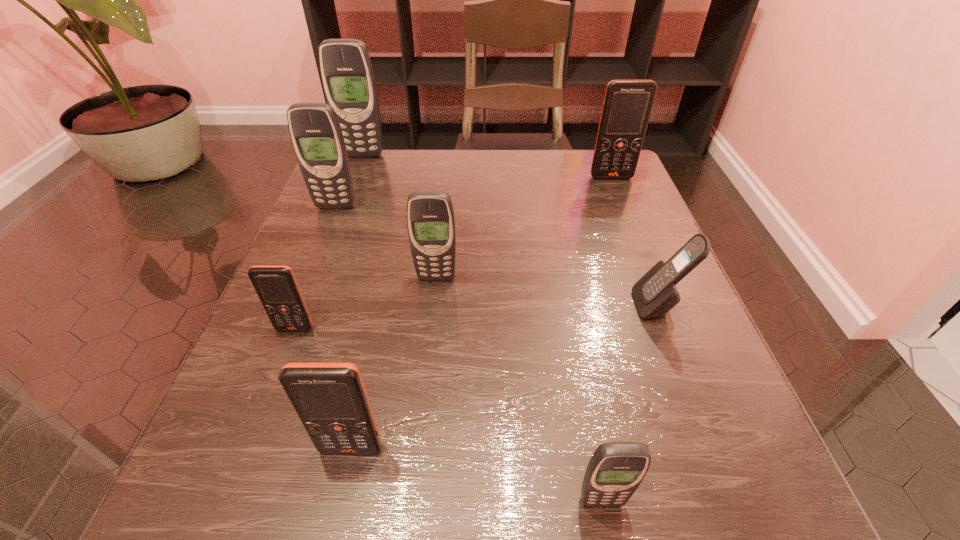
In the image, there is a desktop. Identify the location of vacant area at the far right corner. This screenshot has width=960, height=540. (566, 156).

Find the location of `free area in between the fifth cellular telephone from left to right and the tallest object`. free area in between the fifth cellular telephone from left to right and the tallest object is located at coordinates (400, 217).

The image size is (960, 540). What are the coordinates of `vacant point located between the second smallest gray cellular telephone and the farthest object` in the screenshot? It's located at (400, 217).

Where is `free space that is in between the second farthest object and the sixth nearest cellular telephone`? The height and width of the screenshot is (540, 960). free space that is in between the second farthest object and the sixth nearest cellular telephone is located at coordinates (473, 192).

Image resolution: width=960 pixels, height=540 pixels. I want to click on vacant area that lies between the fourth nearest cellular telephone and the seventh farthest object, so click(x=505, y=377).

Identify the location of vacant area that lies between the farthest gray cellular telephone and the second nearest orange cellular telephone. The height and width of the screenshot is (540, 960). (329, 242).

Identify the location of free spot between the third farthest object and the second farthest cellular telephone. (473, 192).

At what (x,y) coordinates should I click in order to perform the action: click on blank region between the second biggest orange cellular telephone and the seventh nearest object. Please return your answer as a coordinate pair (x, y). This screenshot has width=960, height=540. Looking at the image, I should click on (482, 313).

You are a GUI agent. You are given a task and a screenshot of the screen. Output one action in this format:
    pyautogui.click(x=<x>, y=<y>)
    Task: Click on the vacant area that lies between the farthest gray cellular telephone and the fourth object from right to left
    This screenshot has height=540, width=960.
    Given the screenshot: What is the action you would take?
    pyautogui.click(x=400, y=217)

Find the location of `unoccupied position between the fourth nearest cellular telephone and the third cellular telephone from right to left`. unoccupied position between the fourth nearest cellular telephone and the third cellular telephone from right to left is located at coordinates (630, 403).